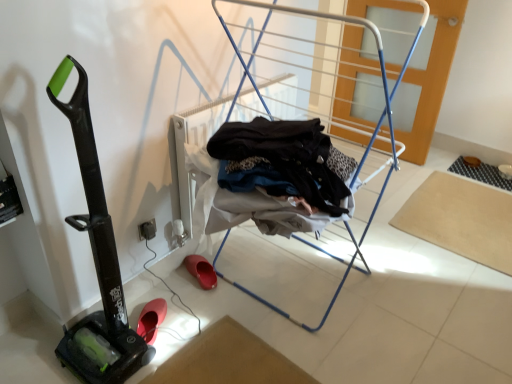
Where is `blank area beneath beige fabric yoga mat at lower right (from a real-world perspective)`? The image size is (512, 384). blank area beneath beige fabric yoga mat at lower right (from a real-world perspective) is located at coordinates (467, 209).